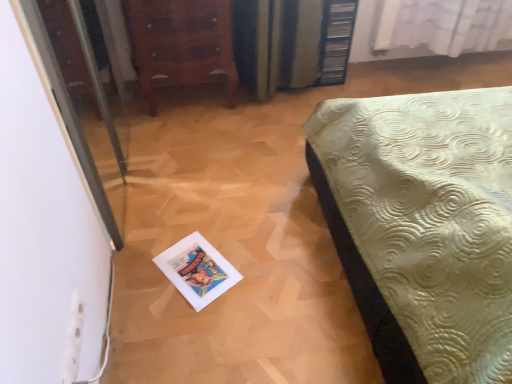
Where is `free space on the front side of wooden chest of drawers at upper left`? free space on the front side of wooden chest of drawers at upper left is located at coordinates (192, 142).